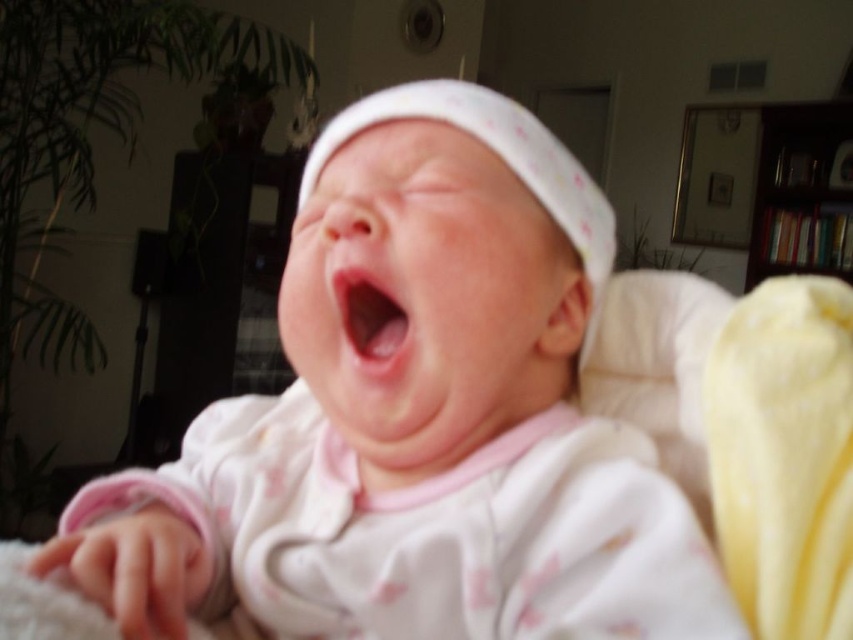
Does point (258, 436) come closer to viewer compared to point (395, 358)?

No, it is behind (395, 358).

Is white soft baby at center thinner than pink matte/skinny object at center?

Incorrect, white soft baby at center's width is not less than pink matte/skinny object at center's.

Find the location of a particular element. The image size is (853, 640). white soft baby at center is located at coordinates (416, 420).

Where is `white soft baby at center`? The width and height of the screenshot is (853, 640). white soft baby at center is located at coordinates (416, 420).